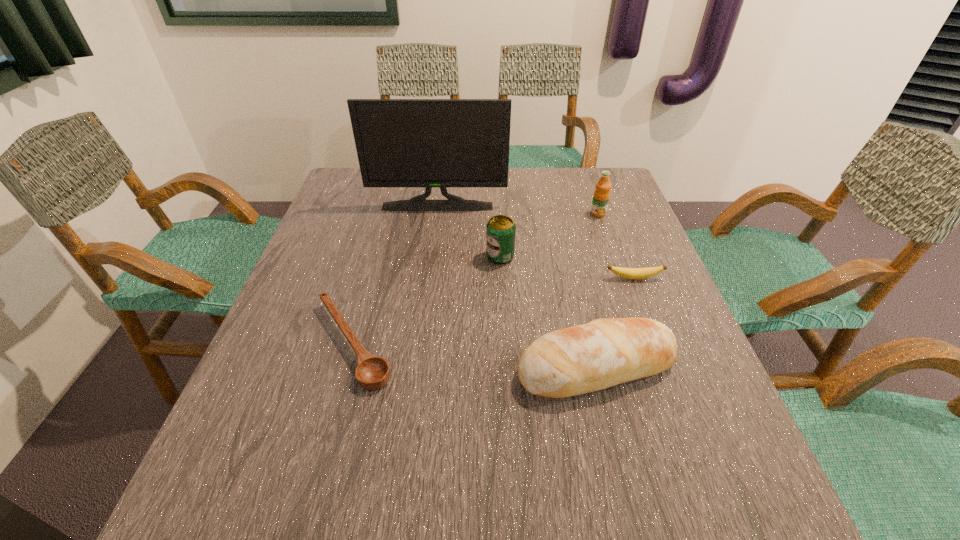
Find the location of `vacant space at the near edge of the desktop`. vacant space at the near edge of the desktop is located at coordinates (462, 490).

Locate an element on the screen. The height and width of the screenshot is (540, 960). free spot at the left edge of the desktop is located at coordinates (367, 209).

Where is `free space at the right edge`? free space at the right edge is located at coordinates (617, 315).

You are a GUI agent. You are given a task and a screenshot of the screen. Output one action in this format:
    pyautogui.click(x=<x>, y=<y>)
    Task: Click on the free space at the far left corner of the desktop
    This screenshot has width=960, height=540.
    Given the screenshot: What is the action you would take?
    pyautogui.click(x=352, y=174)

The height and width of the screenshot is (540, 960). What are the coordinates of `free spot at the far right corner of the desktop` in the screenshot? It's located at (621, 205).

Find the location of `unoccupied area between the wooden spoon and the banana`. unoccupied area between the wooden spoon and the banana is located at coordinates (493, 311).

Identify the location of vacant area that lies between the third farthest object and the orange juice. (549, 235).

Identify the location of vacant area between the fourth nearest object and the bread. The image size is (960, 540). (548, 312).

What are the coordinates of `free space that is in between the wooden spoon and the banana` in the screenshot? It's located at (493, 311).

At what (x,y) coordinates should I click in order to perform the action: click on unoccupied area between the fourth nearest object and the banana. Please return your answer as a coordinate pair (x, y). The width and height of the screenshot is (960, 540). Looking at the image, I should click on (567, 267).